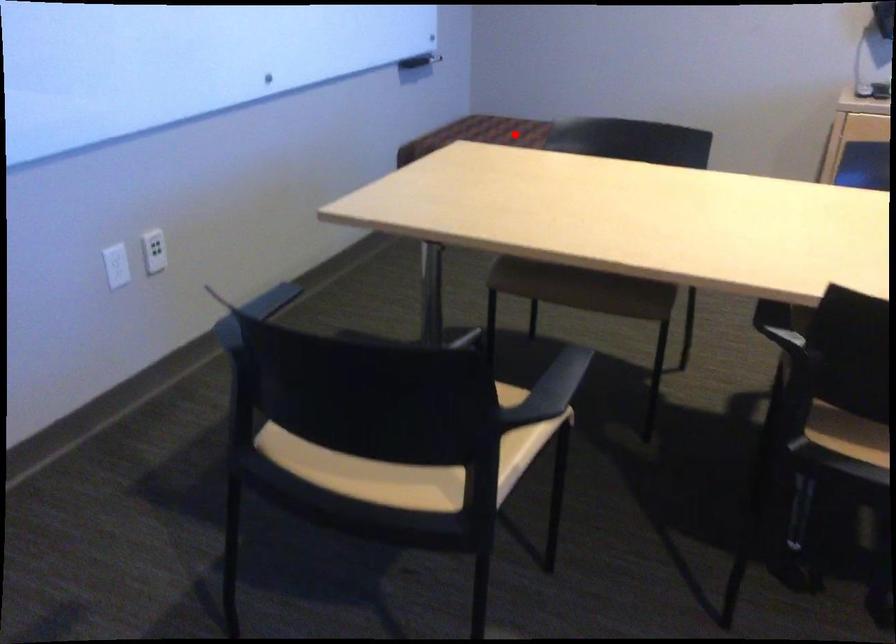
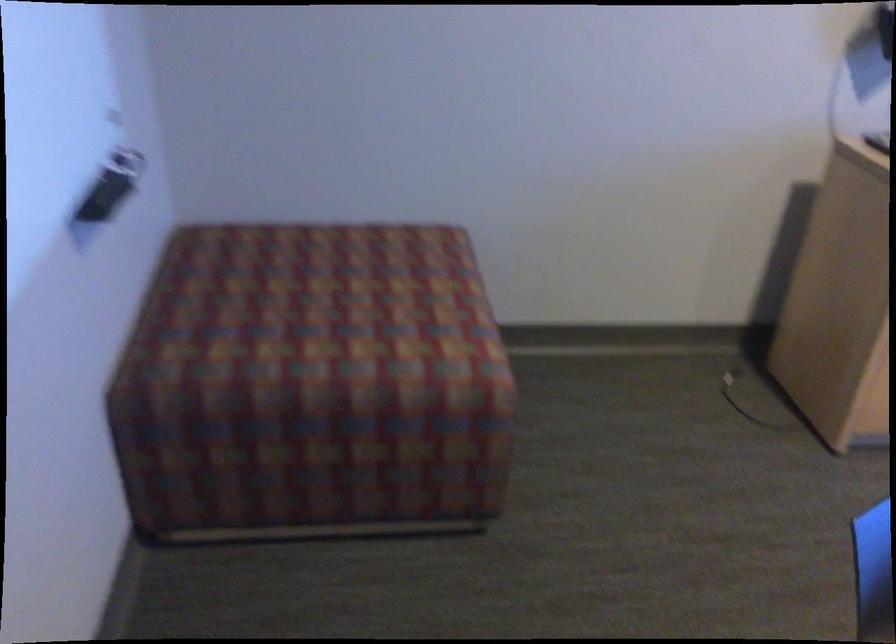
Question: I am providing you with two images of the same scene from different viewpoints. A red point is marked on the first image. Can you still see the location of the red point in image 2?

Choices:
 (A) Yes
 (B) No

Answer: (A)